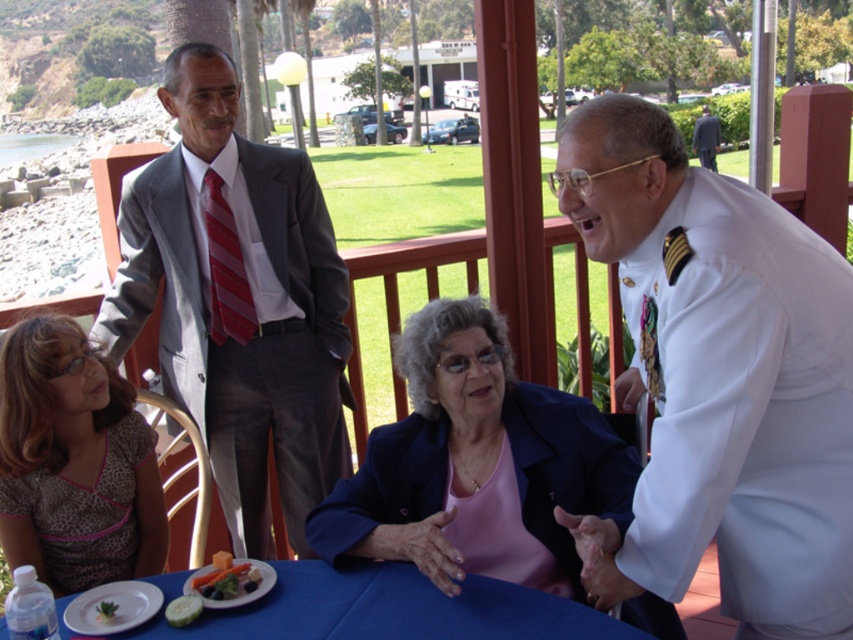
You are a photographer taking a picture of the striped fabric tie at upper center. If your camera has a grid overlay with coordinates from 0 to 1 on both axes, where would you aim to center the tie?

The striped fabric tie at upper center is located at point 0.423 on the x axis and 0.266 on the y axis, so to center it, aim for those coordinates.

You are standing at point [109,602] and want to move to the back of the table. Can you walk directly behind point [210,304] without going around?

Point [210,304] is behind point [109,602], so yes, you can walk directly behind point [210,304] without needing to go around.